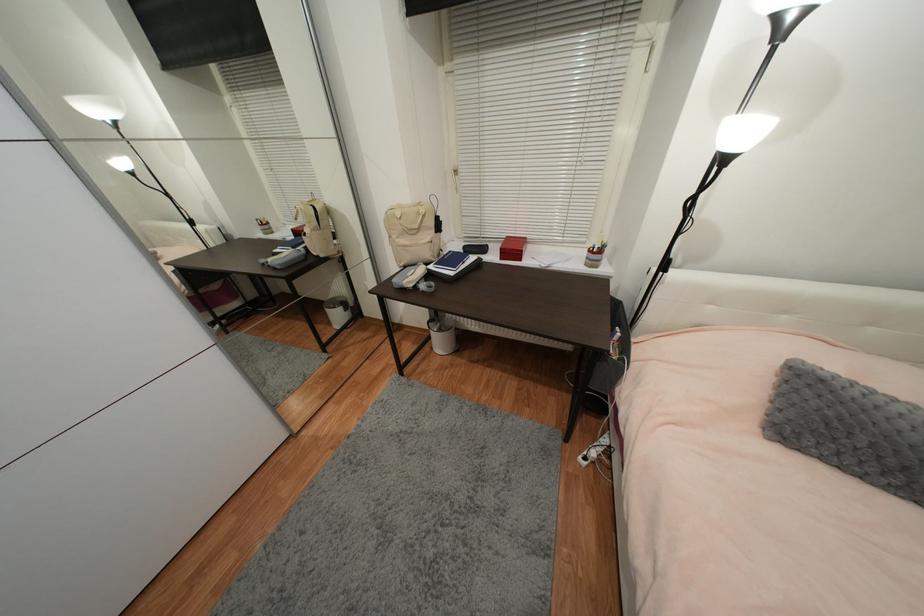
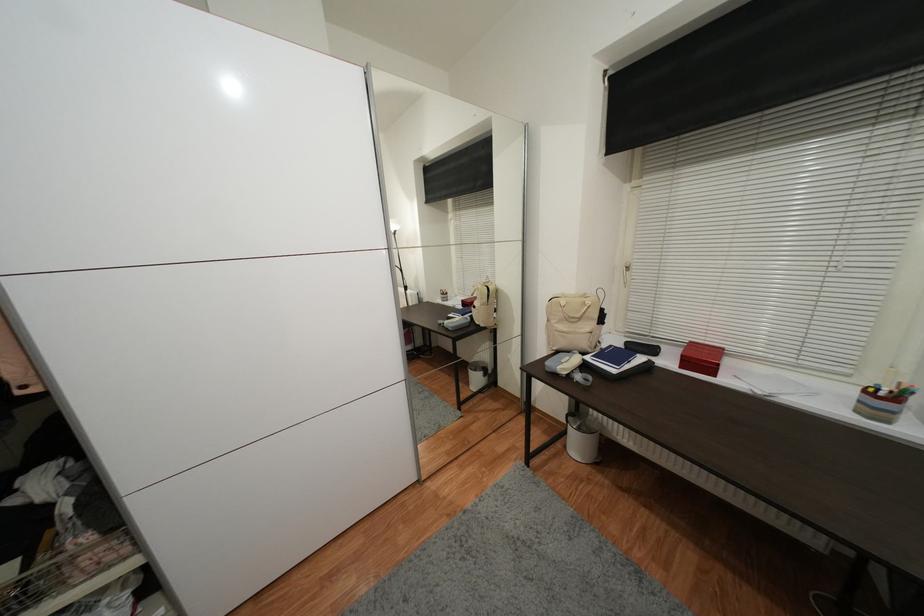
Find the pixel in the second image that matches point 482,49 in the first image.

(678, 167)